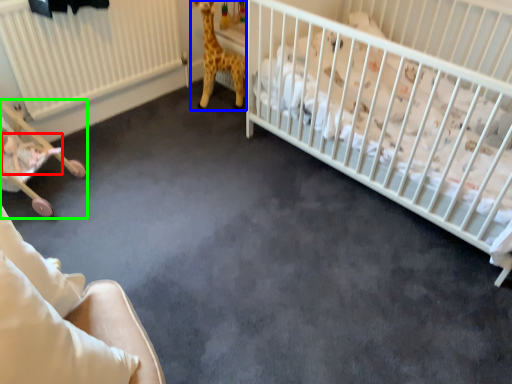
Question: Considering the real-world distances, which object is closest to newborn (highlighted by a red box)? giraffe (highlighted by a blue box) or baby carriage (highlighted by a green box).

Choices:
 (A) giraffe
 (B) baby carriage

Answer: (B)